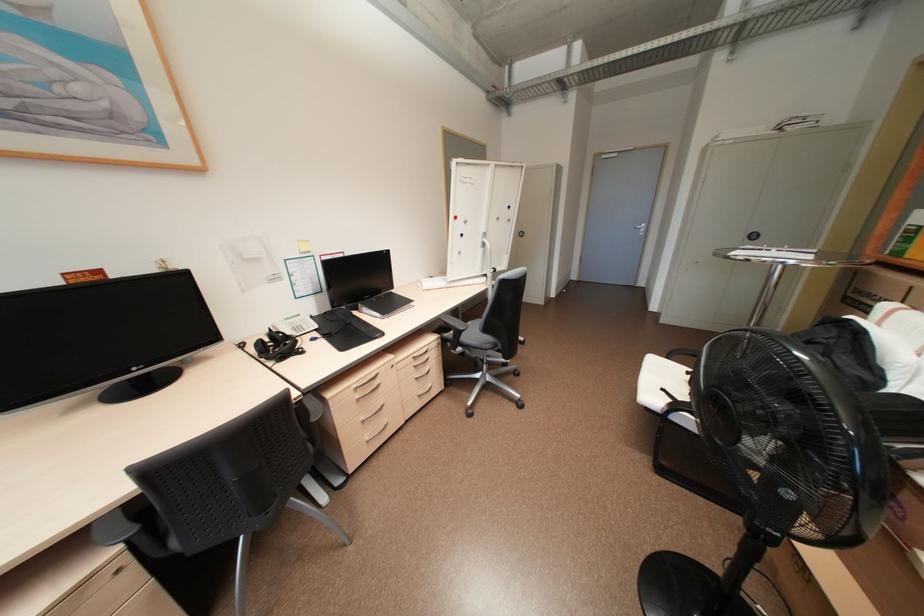
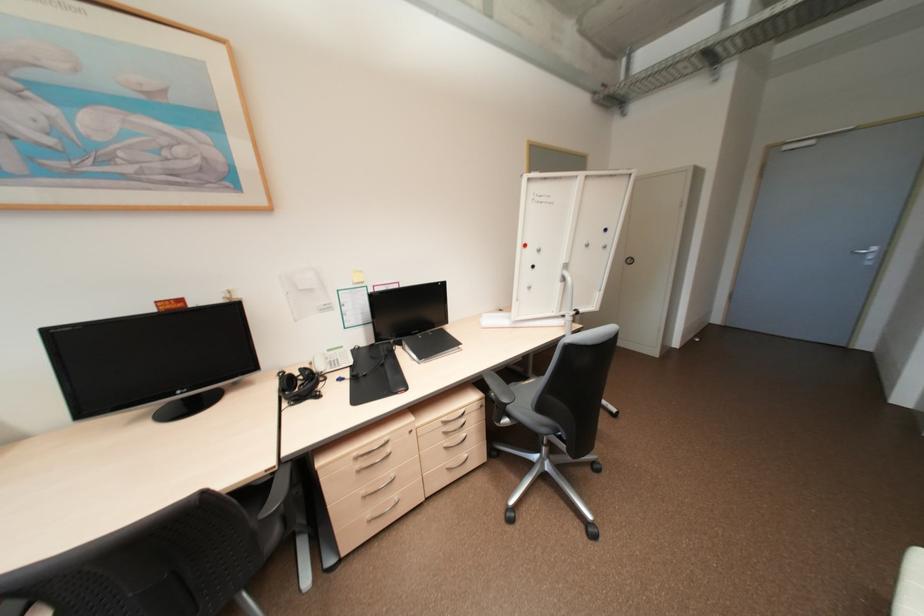
Where in the second image is the point corresponding to point (360, 386) from the first image?

(360, 454)